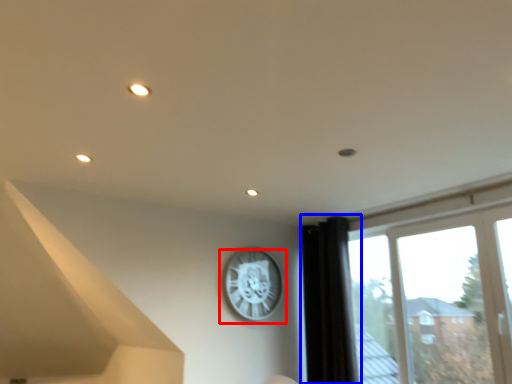
Question: Among these objects, which one is nearest to the camera, wall clock (highlighted by a red box) or curtain (highlighted by a blue box)?

Choices:
 (A) wall clock
 (B) curtain

Answer: (B)